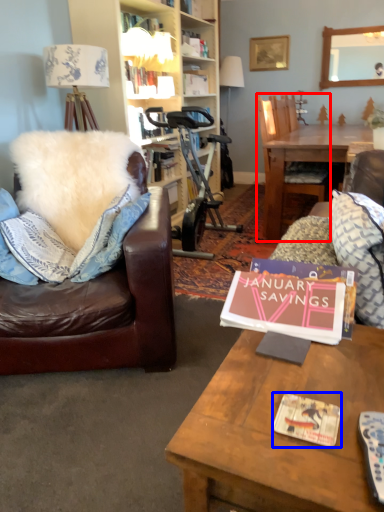
Question: Which object appears farthest to the camera in this image, chair (highlighted by a red box) or magazine (highlighted by a blue box)?

Choices:
 (A) chair
 (B) magazine

Answer: (A)